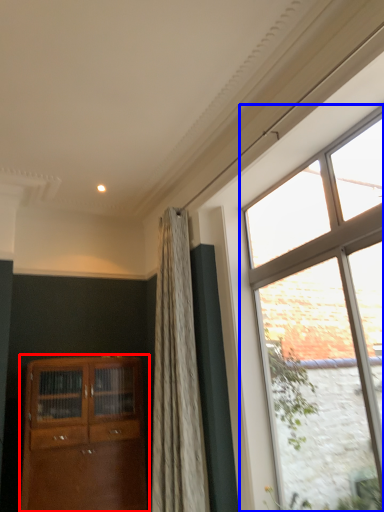
Question: Which object appears farthest to the camera in this image, cabinetry (highlighted by a red box) or window (highlighted by a blue box)?

Choices:
 (A) cabinetry
 (B) window

Answer: (A)